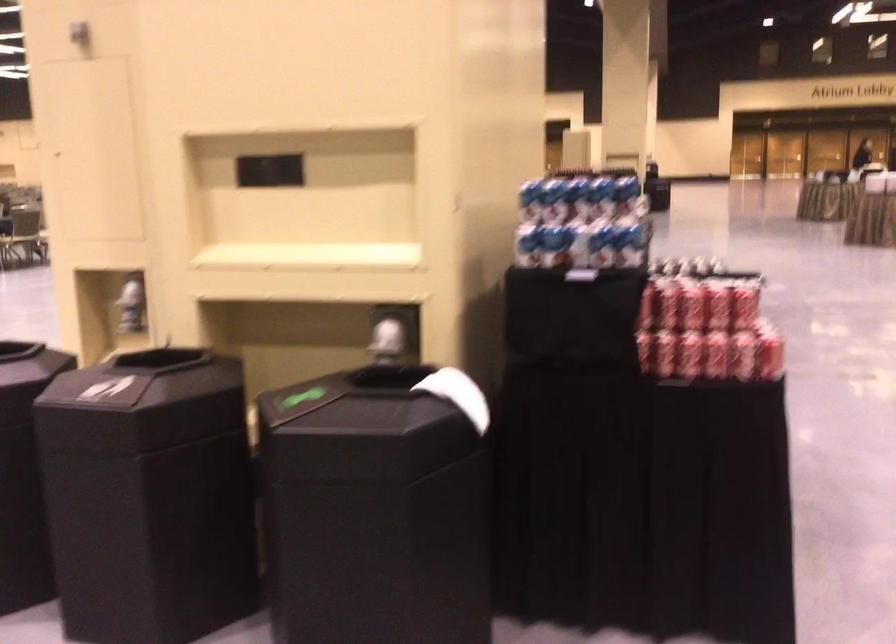
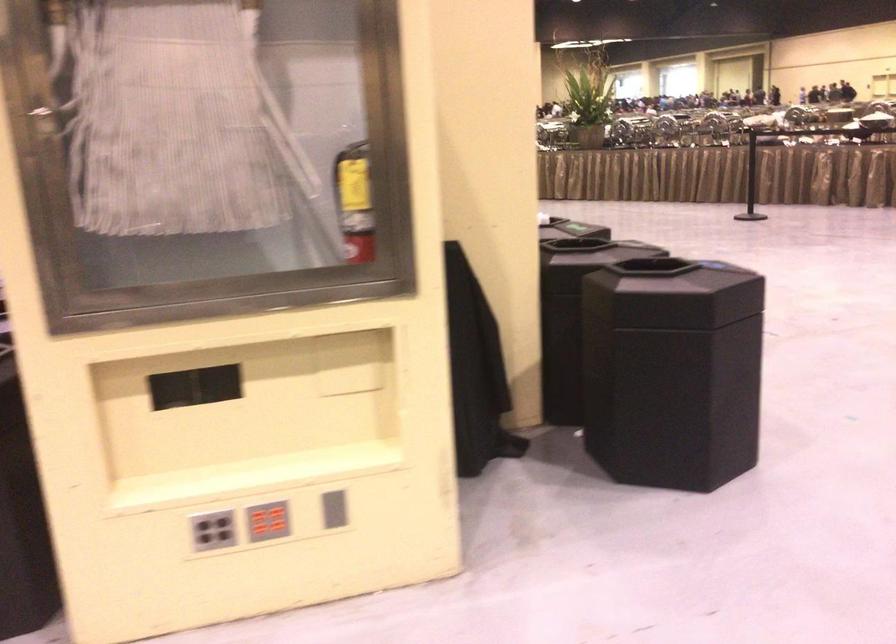
Question: I am providing you with two images of the same scene from different viewpoints. After the viewpoint changes to image2, which objects are now occluded?

Choices:
 (A) red button panel
 (B) blue and white can
 (C) slipper
 (D) grey button panel

Answer: (B)